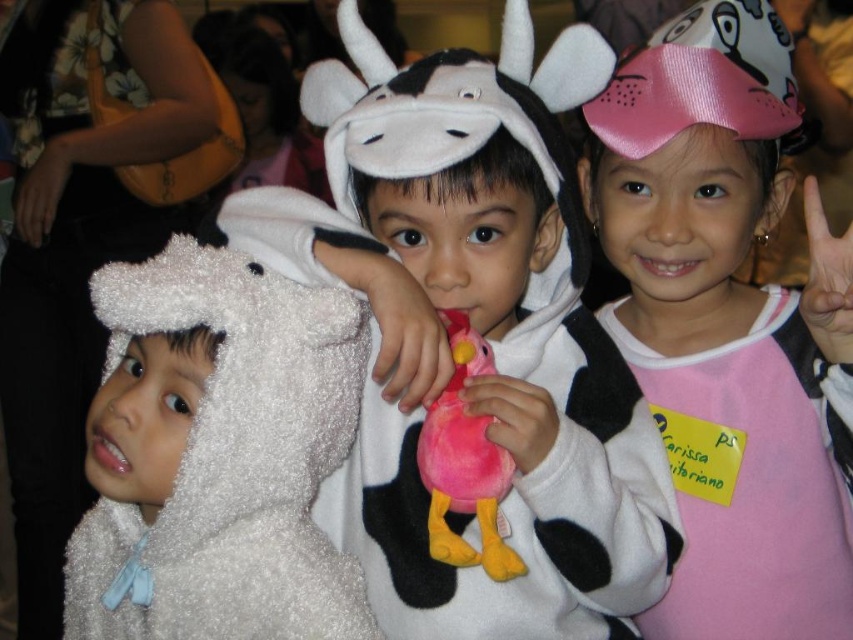
In the scene shown: Who is more forward, (703,552) or (486,476)?

Point (486,476) is in front.

Does point (769, 467) lie behind point (457, 509)?

Yes, point (769, 467) is farther from viewer.

At what (x,y) coordinates should I click in order to perform the action: click on pink satin bow at upper center. Please return your answer as a coordinate pair (x, y). The image size is (853, 640). Looking at the image, I should click on (729, 326).

Who is lower down, fluffy white costume at center or pink plush toy at center?

pink plush toy at center is below.

Between point (561, 458) and point (473, 456), which one is positioned behind?

The point (473, 456) is more distant.

You are a GUI agent. You are given a task and a screenshot of the screen. Output one action in this format:
    pyautogui.click(x=<x>, y=<y>)
    Task: Click on the fluffy white costume at center
    The width and height of the screenshot is (853, 640).
    Given the screenshot: What is the action you would take?
    pyautogui.click(x=479, y=332)

In the scene shown: Does white fluffy costume at left have a smaller size compared to pink plush toy at center?

Actually, white fluffy costume at left might be larger than pink plush toy at center.

Which is behind, point (234, 458) or point (445, 468)?

The point (234, 458) is more distant.

Identify the location of white fluffy costume at left. The image size is (853, 640). (230, 461).